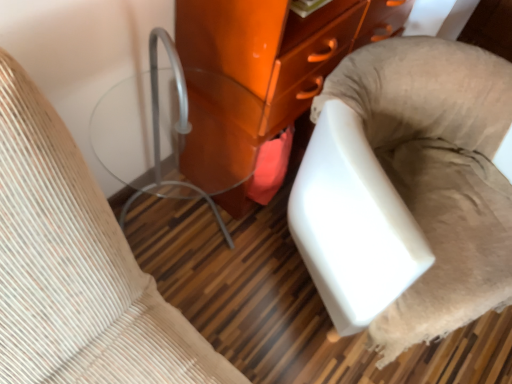
Question: Based on their positions, is matte glass side table at left, which is counted as the 3th furniture, starting from the right, located to the left or right of glossy orange cabinet at center, the 2th furniture viewed from the left?

Choices:
 (A) right
 (B) left

Answer: (B)

Question: Considering their positions, is matte glass side table at left, which is counted as the 3th furniture, starting from the right, located in front of or behind glossy orange cabinet at center, the 2th furniture viewed from the left?

Choices:
 (A) front
 (B) behind

Answer: (A)

Question: Based on their relative distances, which object is nearer to the white fabric chair at lower right, acting as the first furniture starting from the right?

Choices:
 (A) glossy orange cabinet at center, which is the second furniture in right-to-left order
 (B) matte glass side table at left, which is counted as the 3th furniture, starting from the right

Answer: (A)

Question: Estimate the real-world distances between objects in this image. Which object is closer to the white fabric chair at lower right, positioned as the 3th furniture in left-to-right order?

Choices:
 (A) matte glass side table at left, which is counted as the 3th furniture, starting from the right
 (B) glossy orange cabinet at center, the 2th furniture viewed from the left

Answer: (B)